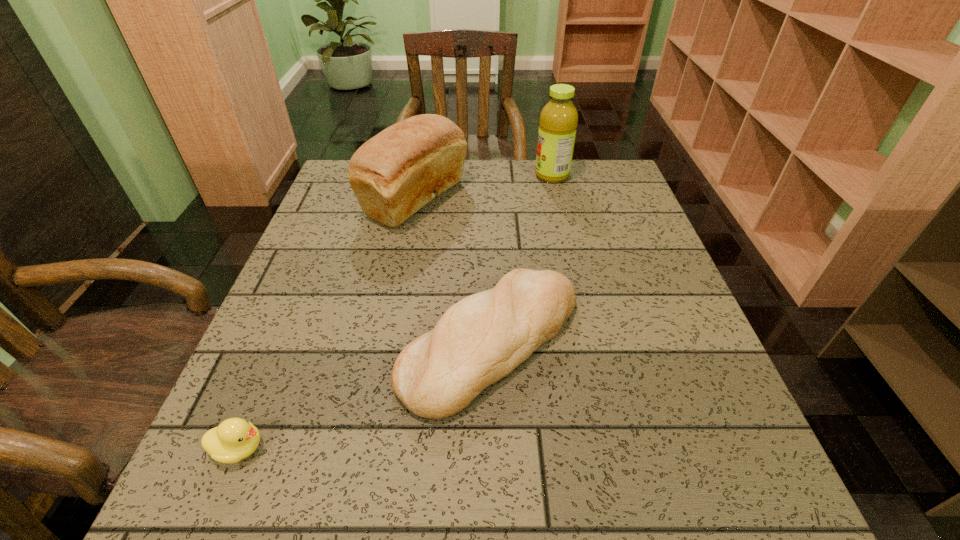
This screenshot has width=960, height=540. Identify the location of vacant region that satisfies the following two spatial constraints: 1. on the front side of the taller bread; 2. on the beak of the duckling. (368, 448).